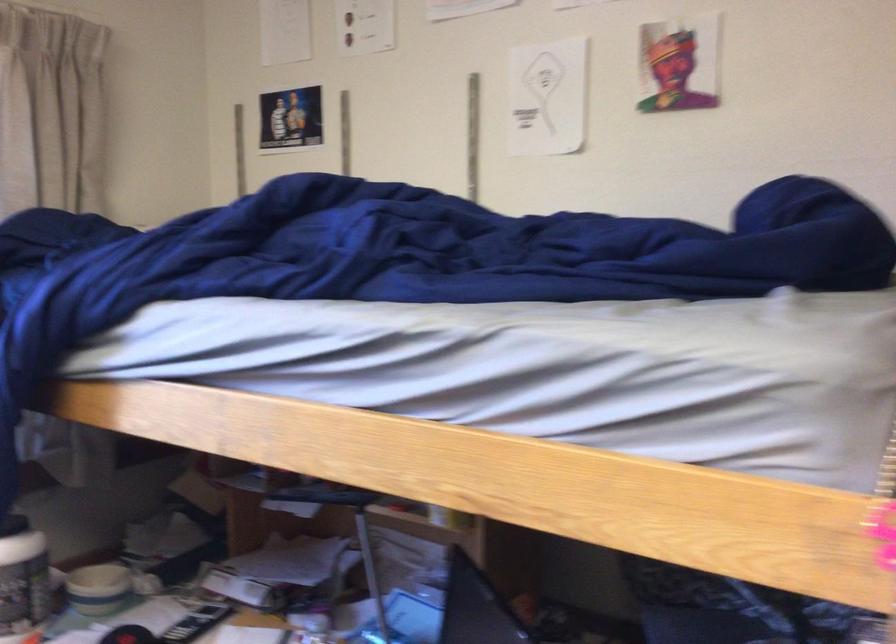
Where is `poster on wall`? The height and width of the screenshot is (644, 896). poster on wall is located at coordinates (290, 118).